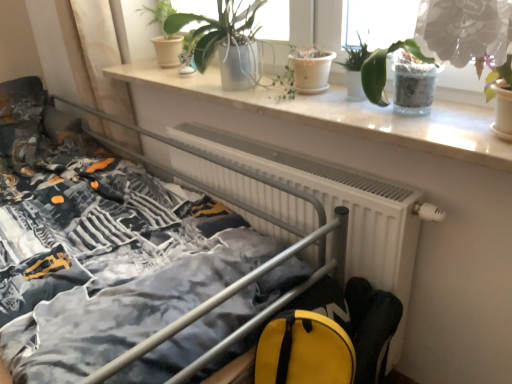
Question: Considering the positions of translucent glass pot at upper right, arranged as the second houseplant when viewed from the right, and green matte plant at upper center, acting as the first houseplant starting from the left, in the image, is translucent glass pot at upper right, arranged as the second houseplant when viewed from the right, taller or shorter than green matte plant at upper center, acting as the first houseplant starting from the left,?

Choices:
 (A) short
 (B) tall

Answer: (A)

Question: Is point (428, 107) closer or farther from the camera than point (160, 39)?

Choices:
 (A) farther
 (B) closer

Answer: (B)

Question: Which is nearer to the matte white pot at upper center, acting as the fourth houseplant starting from the right?

Choices:
 (A) green leafy plant at upper center, which is the third houseplant in right-to-left order
 (B) green matte plant at upper center, acting as the first houseplant starting from the left
 (C) metallic gray bed at center
 (D) white marble window sill at upper center
 (E) green glossy plant at upper right, which appears as the fifth houseplant when viewed from the left

Answer: (D)

Question: Which is farther from the green glossy plant at upper right, which appears as the fifth houseplant when viewed from the left?

Choices:
 (A) white matte radiator at center
 (B) matte white pot at upper center, marked as the 2th houseplant in a left-to-right arrangement
 (C) green matte plant at upper center, acting as the first houseplant starting from the left
 (D) white marble window sill at upper center
 (E) translucent glass pot at upper right, arranged as the fourth houseplant when viewed from the left

Answer: (C)